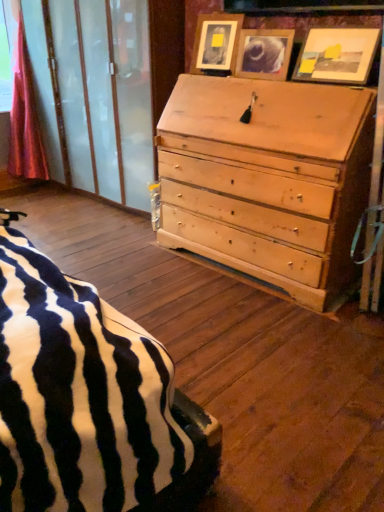
Question: From a real-world perspective, is matte wooden picture frame at upper right, which ranks as the 3th picture frame in left-to-right order, below wooden picture frame at upper center, the third picture frame when ordered from right to left?

Choices:
 (A) yes
 (B) no

Answer: (B)

Question: Is matte wooden picture frame at upper right, acting as the 1th picture frame starting from the right, positioned before wooden picture frame at upper center, placed as the first picture frame when sorted from left to right?

Choices:
 (A) yes
 (B) no

Answer: (A)

Question: Is wooden picture frame at upper center, placed as the first picture frame when sorted from left to right, inside matte wooden picture frame at upper right, acting as the 1th picture frame starting from the right?

Choices:
 (A) yes
 (B) no

Answer: (B)

Question: Is matte wooden picture frame at upper right, acting as the 1th picture frame starting from the right, to the right of wooden picture frame at upper center, placed as the first picture frame when sorted from left to right, from the viewer's perspective?

Choices:
 (A) no
 (B) yes

Answer: (B)

Question: From the image's perspective, does matte wooden picture frame at upper right, acting as the 1th picture frame starting from the right, appear higher than wooden picture frame at upper center, the third picture frame when ordered from right to left?

Choices:
 (A) yes
 (B) no

Answer: (B)

Question: Is point (291, 46) positioned closer to the camera than point (349, 49)?

Choices:
 (A) closer
 (B) farther

Answer: (B)

Question: Considering the positions of matte wooden picture frame at upper center, the second picture frame from the left, and matte wooden picture frame at upper right, which ranks as the 3th picture frame in left-to-right order, in the image, is matte wooden picture frame at upper center, the second picture frame from the left, wider or thinner than matte wooden picture frame at upper right, which ranks as the 3th picture frame in left-to-right order,?

Choices:
 (A) thin
 (B) wide

Answer: (A)

Question: In terms of size, does matte wooden picture frame at upper center, the second picture frame from the left, appear bigger or smaller than matte wooden picture frame at upper right, which ranks as the 3th picture frame in left-to-right order?

Choices:
 (A) big
 (B) small

Answer: (B)

Question: From a real-world perspective, is matte wooden picture frame at upper center, the second picture frame positioned from the right, above or below matte wooden picture frame at upper right, which ranks as the 3th picture frame in left-to-right order?

Choices:
 (A) above
 (B) below

Answer: (B)

Question: In the image, is wooden picture frame at upper center, the third picture frame when ordered from right to left, on the left side or the right side of matte wooden picture frame at upper right, which ranks as the 3th picture frame in left-to-right order?

Choices:
 (A) right
 (B) left

Answer: (B)

Question: In terms of size, does wooden picture frame at upper center, the third picture frame when ordered from right to left, appear bigger or smaller than matte wooden picture frame at upper right, acting as the 1th picture frame starting from the right?

Choices:
 (A) small
 (B) big

Answer: (A)

Question: Choose the correct answer: Is wooden picture frame at upper center, the third picture frame when ordered from right to left, inside matte wooden picture frame at upper right, which ranks as the 3th picture frame in left-to-right order, or outside it?

Choices:
 (A) inside
 (B) outside

Answer: (B)

Question: From the image's perspective, is wooden picture frame at upper center, the third picture frame when ordered from right to left, positioned above or below matte wooden picture frame at upper right, which ranks as the 3th picture frame in left-to-right order?

Choices:
 (A) below
 (B) above

Answer: (B)

Question: From their relative heights in the image, would you say pink satin curtain at left is taller or shorter than wooden picture frame at upper center, placed as the first picture frame when sorted from left to right?

Choices:
 (A) short
 (B) tall

Answer: (B)

Question: Is pink satin curtain at left spatially inside wooden picture frame at upper center, placed as the first picture frame when sorted from left to right, or outside of it?

Choices:
 (A) inside
 (B) outside

Answer: (B)